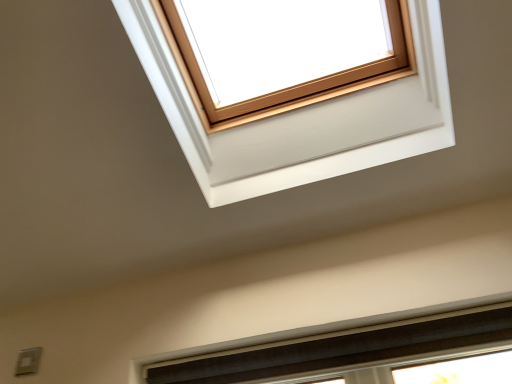
Identify the location of matte black frame at lower center. The width and height of the screenshot is (512, 384). (342, 348).

The width and height of the screenshot is (512, 384). What do you see at coordinates (342, 348) in the screenshot? I see `matte black frame at lower center` at bounding box center [342, 348].

I want to click on matte black frame at lower center, so click(x=342, y=348).